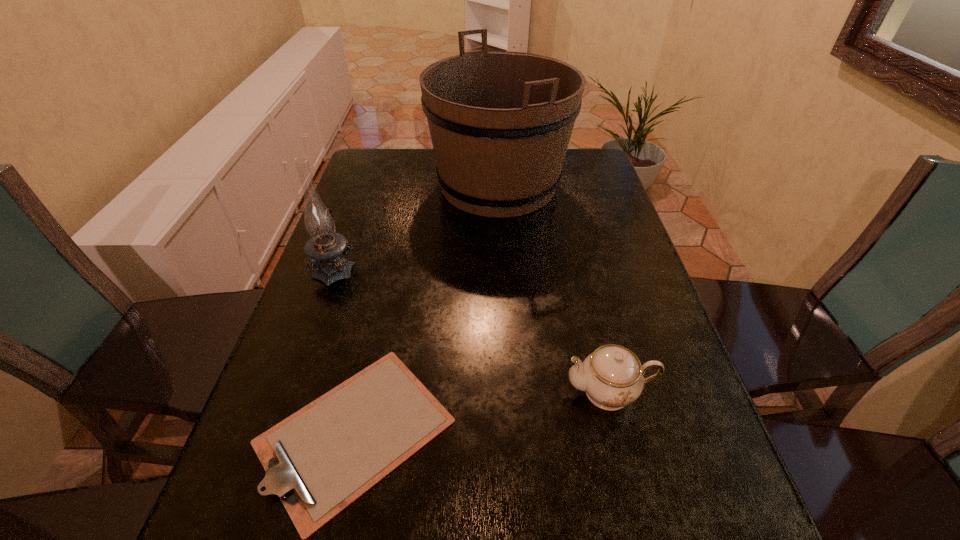
Where is `object located in the far edge section of the desktop`? The height and width of the screenshot is (540, 960). object located in the far edge section of the desktop is located at coordinates click(x=500, y=122).

At what (x,y) coordinates should I click in order to perform the action: click on object located at the left edge. Please return your answer as a coordinate pair (x, y). The width and height of the screenshot is (960, 540). Looking at the image, I should click on (324, 248).

Find the location of `bucket that is at the right edge`. bucket that is at the right edge is located at coordinates (500, 122).

This screenshot has height=540, width=960. What are the coordinates of `chinaware located in the right edge section of the desktop` in the screenshot? It's located at (612, 376).

Identify the location of object situated at the far right corner. The height and width of the screenshot is (540, 960). (500, 122).

At what (x,y) coordinates should I click in order to perform the action: click on vacant space at the left edge of the desktop. Please return your answer as a coordinate pair (x, y). The image size is (960, 540). Looking at the image, I should click on (293, 362).

You are a GUI agent. You are given a task and a screenshot of the screen. Output one action in this format:
    pyautogui.click(x=<x>, y=<y>)
    Task: Click on the vacant region at the right edge of the desktop
    The width and height of the screenshot is (960, 540).
    Given the screenshot: What is the action you would take?
    point(634,348)

In the image, there is a desktop. In order to click on vacant space at the far left corner in this screenshot , I will do `click(372, 179)`.

Identify the location of vacant space at the far right corner of the desktop. The width and height of the screenshot is (960, 540). (577, 156).

Locate an element on the screen. The width and height of the screenshot is (960, 540). vacant area that lies between the bucket and the second farthest object is located at coordinates (417, 226).